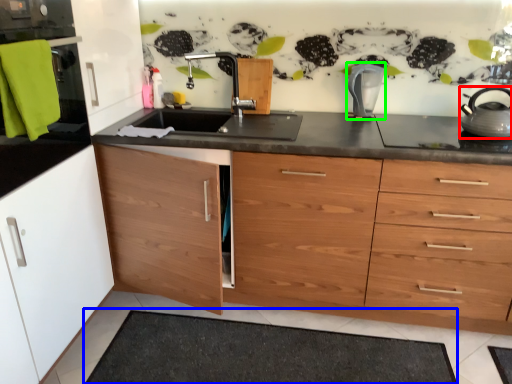
Question: Which object is the closest to the home appliance (highlighted by a red box)? Choose among these: bath mat (highlighted by a blue box) or kitchen appliance (highlighted by a green box).

Choices:
 (A) bath mat
 (B) kitchen appliance

Answer: (B)